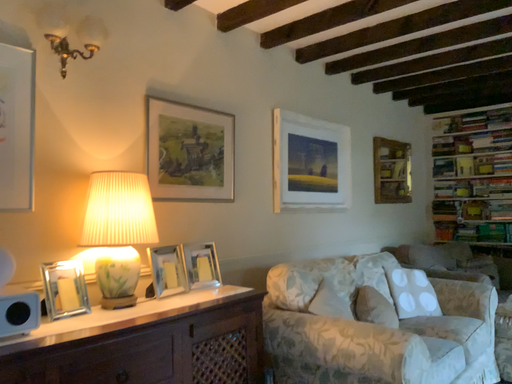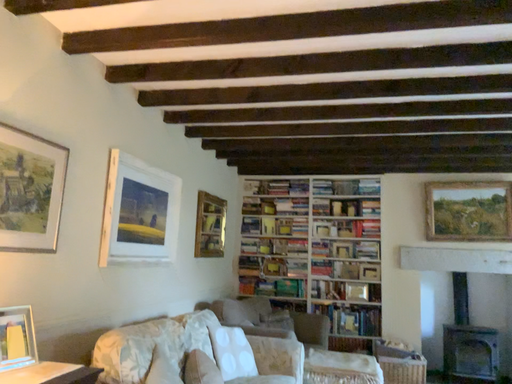
Question: How did the camera likely rotate when shooting the video?

Choices:
 (A) rotated right
 (B) rotated left

Answer: (A)